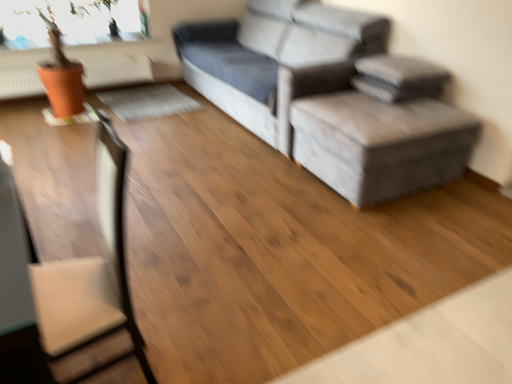
The image size is (512, 384). Identify the location of vacant area that lies in front of gray fabric ottoman at center. (395, 236).